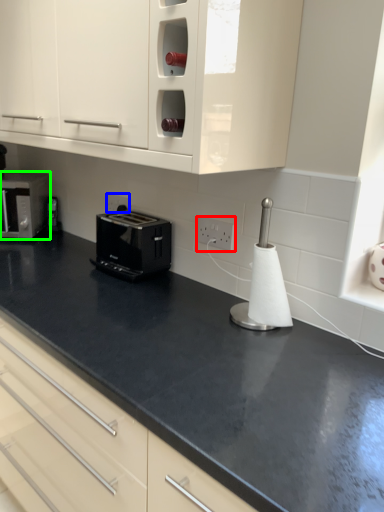
Question: Which object is the closest to the electric outlet (highlighted by a red box)? Choose among these: electric outlet (highlighted by a blue box) or home appliance (highlighted by a green box).

Choices:
 (A) electric outlet
 (B) home appliance

Answer: (A)